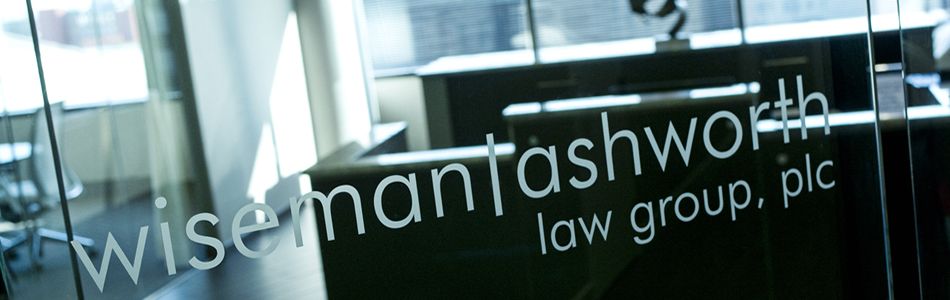
Locate an element on the screen. far window in other room is located at coordinates (87, 26), (10, 71).